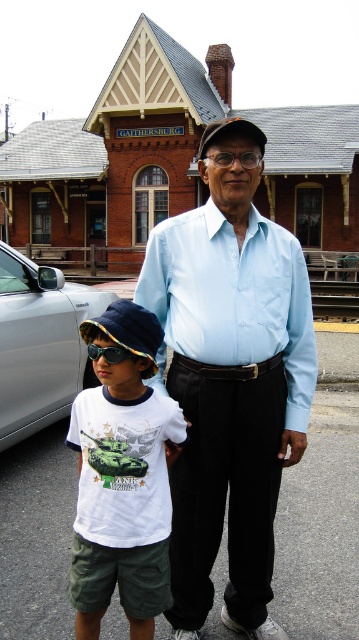
You are designing a new outfit for a character in a video game. The character will wear both a light blue shirt at center and blue reflective sunglasses at left. Which item should you make wider to ensure it fits the character properly?

The light blue shirt at center should be made wider because its width is larger than the blue reflective sunglasses at left.

From the picture: You are a photographer trying to capture a portrait of both the light blue shirt at center and the blue reflective sunglasses at left in the image. Since you want both subjects to be clearly visible, which object should you focus on first to ensure proper exposure, considering their size in the frame?

The light blue shirt at center has a greater height compared to the blue reflective sunglasses at left, so you should focus on the light blue shirt at center first because it is larger and will require more precise exposure adjustments.

You are standing in front of the brick building and notice two items of clothing and accessories. The light blue shirt at center and the blue reflective sunglasses at left. Which item is positioned lower in the image?

The light blue shirt at center is located below blue reflective sunglasses at left, so the light blue shirt at center is positioned lower in the image.